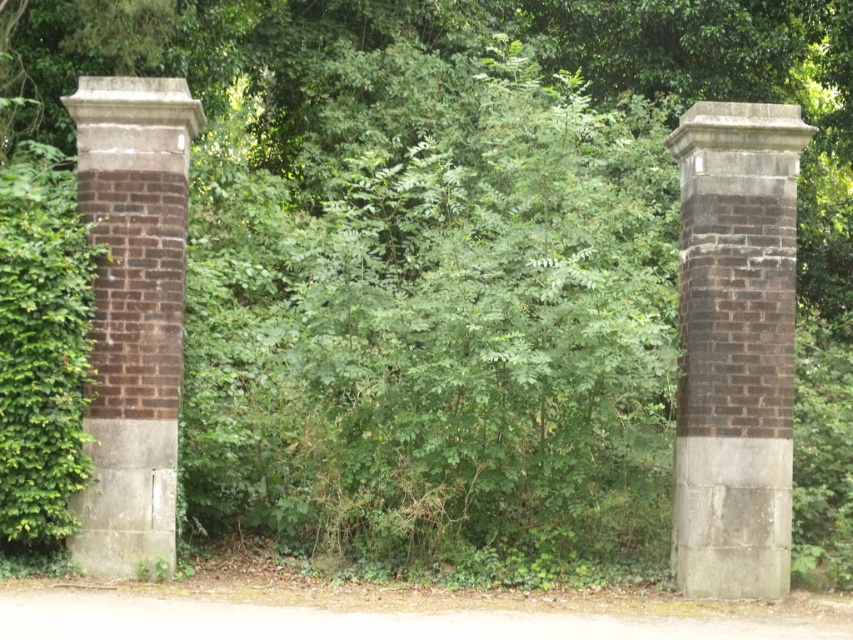
Question: Does brown brick column at right have a greater width compared to brown brick pillar at left?

Choices:
 (A) no
 (B) yes

Answer: (B)

Question: Observing the image, what is the correct spatial positioning of brown brick column at right in reference to brown brick pillar at left?

Choices:
 (A) above
 (B) below

Answer: (B)

Question: Is brown brick column at right wider than brown brick pillar at left?

Choices:
 (A) yes
 (B) no

Answer: (A)

Question: Which point is closer to the camera?

Choices:
 (A) (747, 152)
 (B) (142, 563)

Answer: (B)